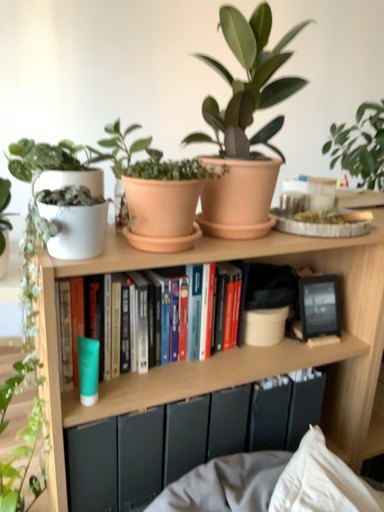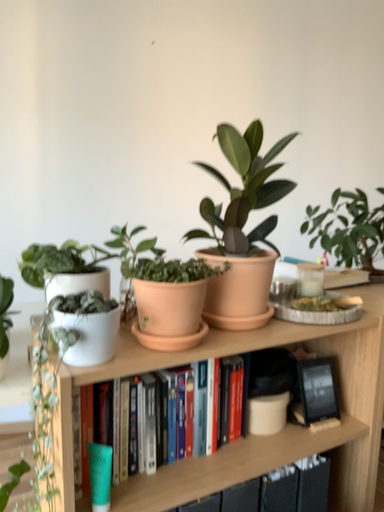
Question: Which way did the camera rotate in the video?

Choices:
 (A) rotated upward
 (B) rotated downward

Answer: (A)